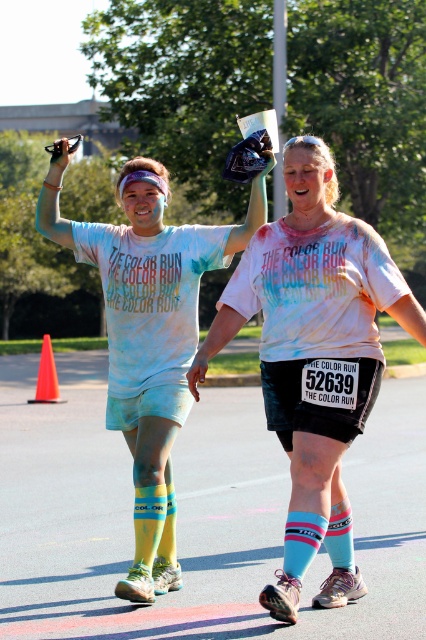
Which is more to the left, matte white t-shirt at center or orange plastic cone at lower left?

From the viewer's perspective, orange plastic cone at lower left appears more on the left side.

Locate an element on the screen. matte white t-shirt at center is located at coordinates (313, 348).